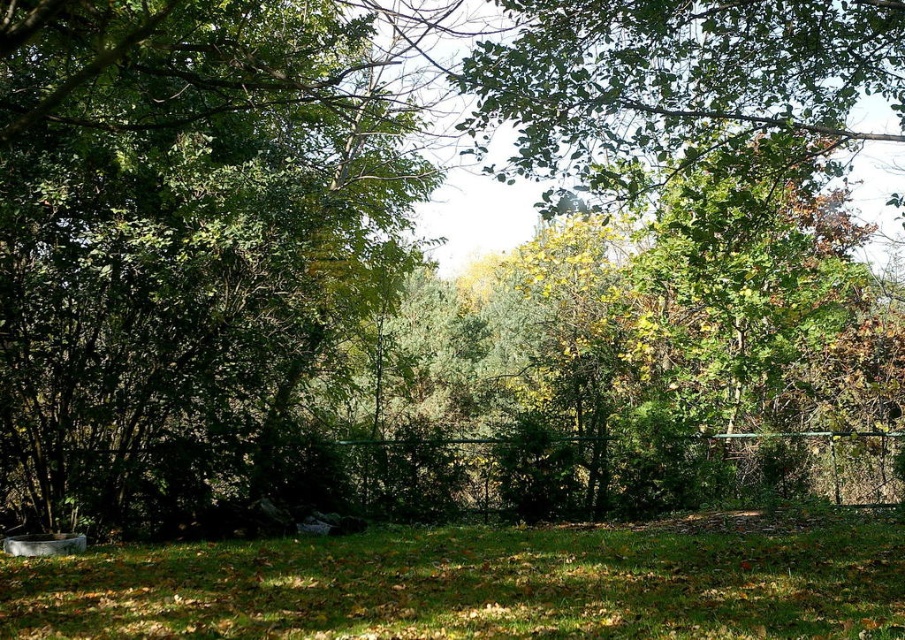
Between point (250, 609) and point (719, 436), which one is positioned behind?

Positioned behind is point (719, 436).

Who is positioned more to the left, green grassy at lower center or green metal fence at center?

green grassy at lower center is more to the left.

Between point (799, 604) and point (801, 436), which one is positioned behind?

The point (801, 436) is behind.

This screenshot has height=640, width=905. Identify the location of green grassy at lower center. (477, 586).